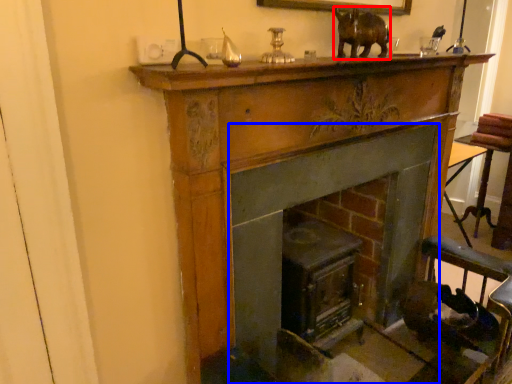
Question: Among these objects, which one is nearest to the camera, animal (highlighted by a red box) or fireplace (highlighted by a blue box)?

Choices:
 (A) animal
 (B) fireplace

Answer: (A)